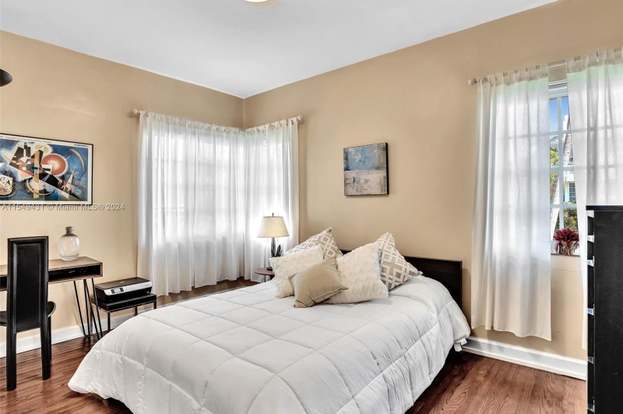
You are a GUI agent. You are given a task and a screenshot of the screen. Output one action in this format:
    pyautogui.click(x=<x>, y=<y>)
    Task: Click on the throw pillow on bed
    Image resolution: width=623 pixels, height=414 pixels.
    Given the screenshot: What is the action you would take?
    pyautogui.click(x=293, y=263), pyautogui.click(x=323, y=241), pyautogui.click(x=316, y=278), pyautogui.click(x=359, y=278), pyautogui.click(x=391, y=266)